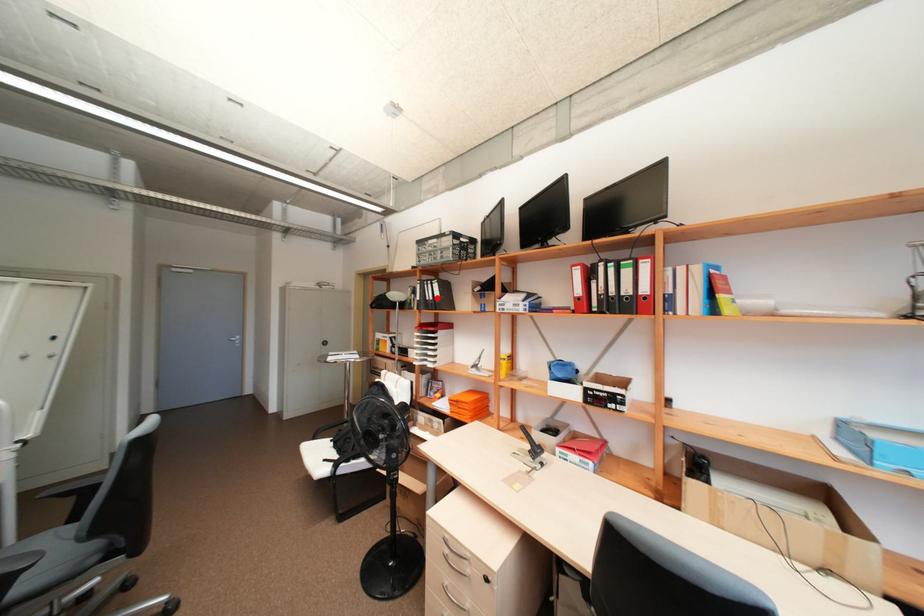
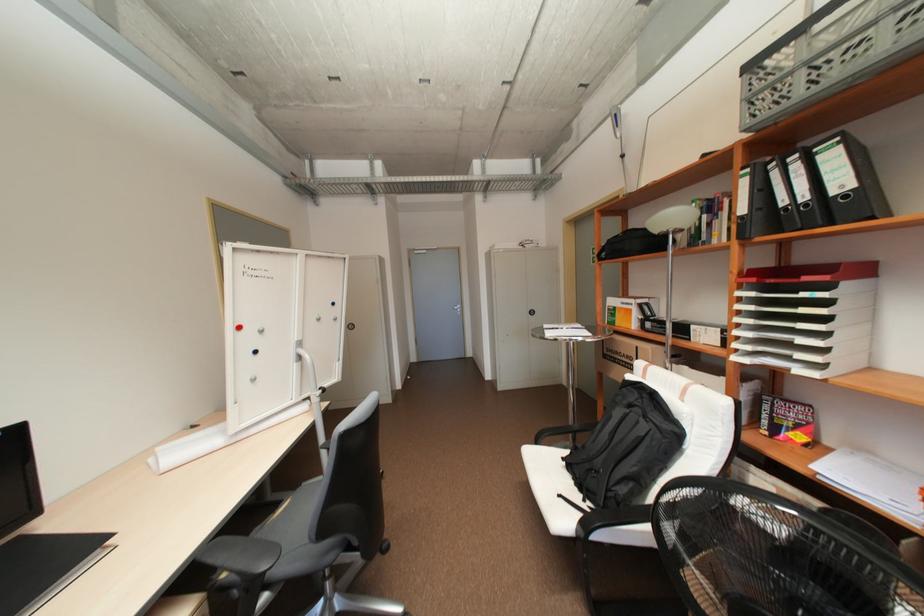
Where in the second image is the point corresponding to the highlighted location from the first image?

(810, 197)